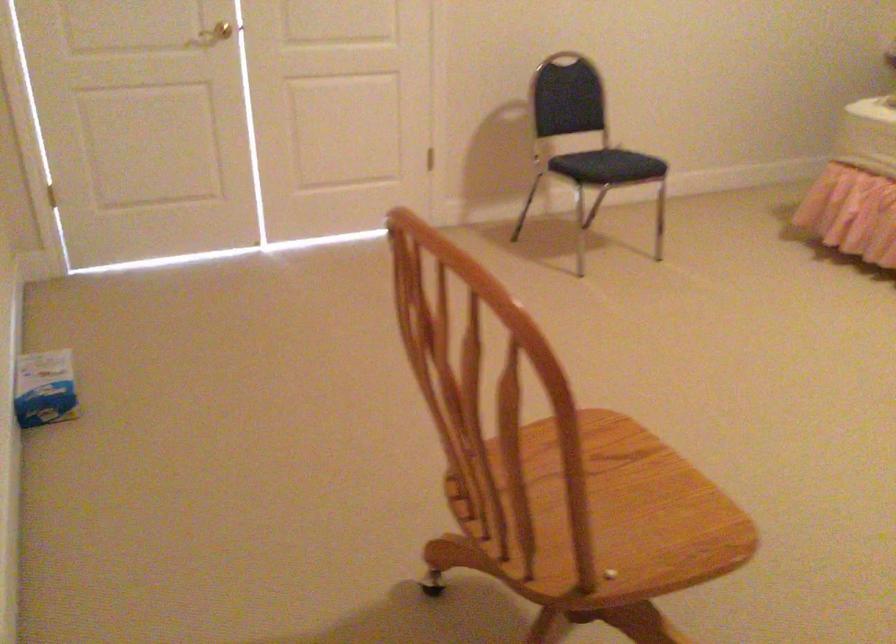
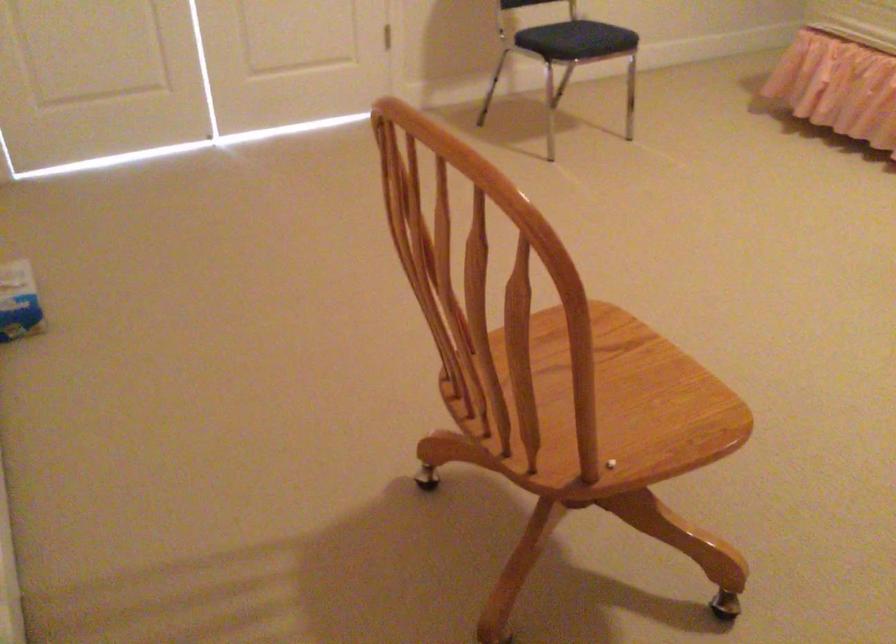
Question: The first image is from the beginning of the video and the second image is from the end. How did the camera likely rotate when shooting the video?

Choices:
 (A) Left
 (B) Right
 (C) Up
 (D) Down

Answer: (D)